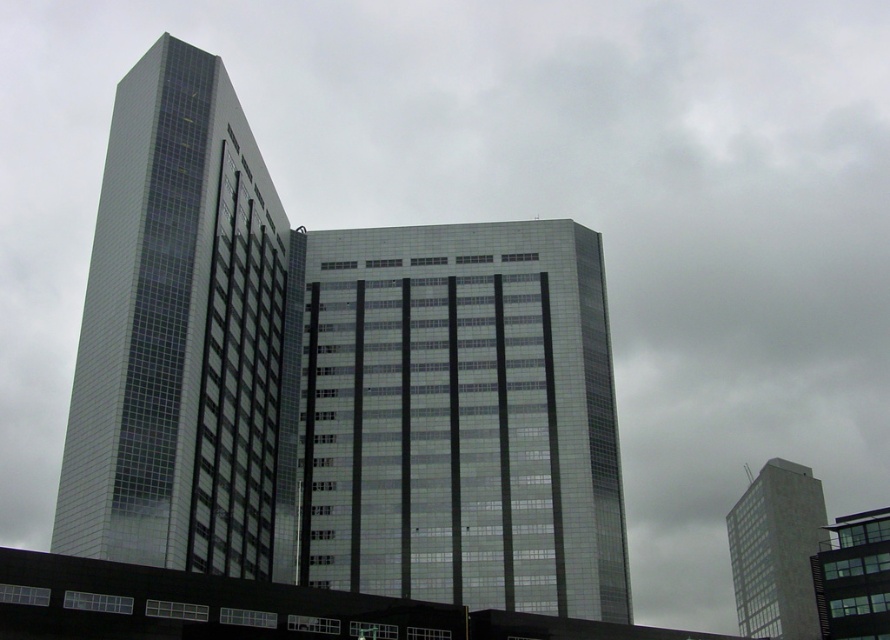
You are an architect analyzing the urban layout. Based on the scene, which object is located below the other between the smooth concrete tower at right and the glassy reflective building at lower right?

The smooth concrete tower at right is positioned under the glassy reflective building at lower right, meaning it is located below the other.

You are a drone operator tasked with flying a drone between the glassy reflective building at center and the smooth concrete tower at right. The drone has a maximum flight distance of 100 meters. Can the drone safely fly between these two buildings without exceeding its maximum range?

The glassy reflective building at center and smooth concrete tower at right are 100.41 meters apart from each other. Since the drone can only fly up to 100 meters, it cannot safely fly between them as the distance exceeds its maximum range by 0.41 meters.

You are standing in the middle of the city square and see the glassy reflective tower at left. If you want to take a photo of it from a distance of 50 meters, should you move closer or farther away?

The glassy reflective tower at left is currently 48.27 meters away from you. To achieve a distance of 50 meters, you need to move farther away from the tower.